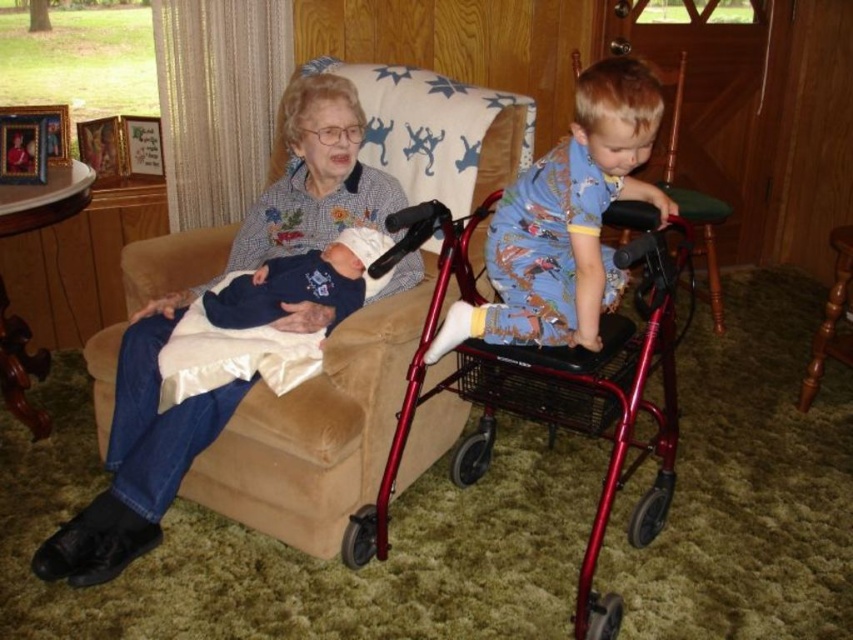
Is blue cotton pajamas at center thinner than wooden chair at right?

Yes.

Does blue cotton pajamas at center have a larger size compared to wooden chair at right?

No.

What are the coordinates of `blue cotton pajamas at center` in the screenshot? It's located at (566, 220).

Can you confirm if metallic red walker at center is positioned above dark blue fabric baby at center?

Actually, metallic red walker at center is below dark blue fabric baby at center.

Can you confirm if metallic red walker at center is positioned to the right of dark blue fabric baby at center?

Correct, you'll find metallic red walker at center to the right of dark blue fabric baby at center.

The width and height of the screenshot is (853, 640). What do you see at coordinates (592, 397) in the screenshot? I see `metallic red walker at center` at bounding box center [592, 397].

Locate an element on the screen. The height and width of the screenshot is (640, 853). metallic red walker at center is located at coordinates (592, 397).

Is point (131, 374) farther from camera compared to point (480, 426)?

No, it is not.

Is matte blue shirt at center thinner than metallic red walker at center?

No.

Who is more distant from viewer, (323, 317) or (665, 388)?

Point (665, 388)

Identify the location of matte blue shirt at center. The image size is (853, 640). (137, 458).